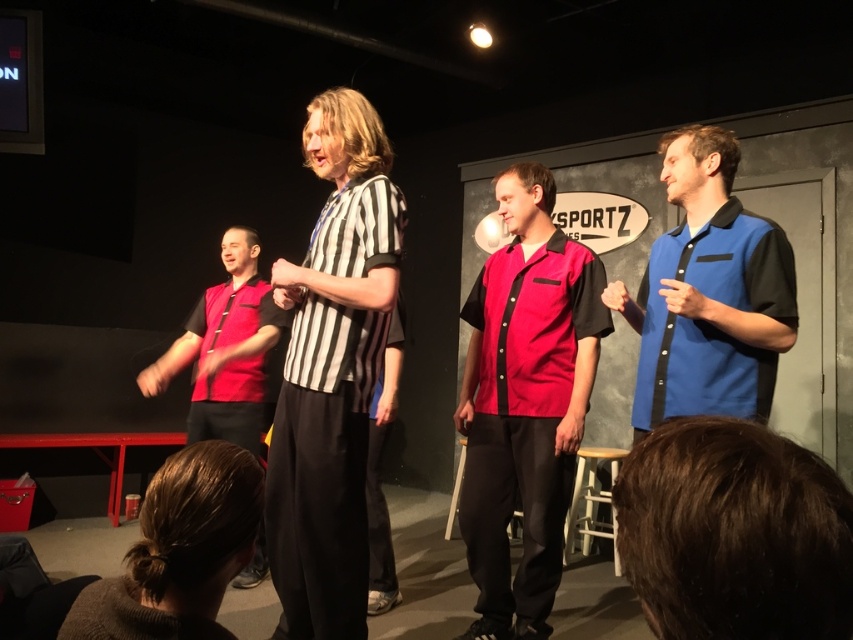
You are sitting in the audience and see two points on the stage. The first point is at coordinate point (x=282, y=269) and the second is at point (x=648, y=294). Which point is closer to you?

Point (x=282, y=269) is in front of point (x=648, y=294), so it is closer to you.

You are a photographer standing at the back of the audience. You want to take a photo of both the shiny red bowling shirt at center and the matte red shirt at center. The minimum distance your camera can focus on two objects is 1.5 meters. Can you capture both in focus?

The shiny red bowling shirt at center is 1.28 meters from matte red shirt at center. Since the distance between them is less than the camera minimum focus distance of 1.5 meters, you can capture both in focus.